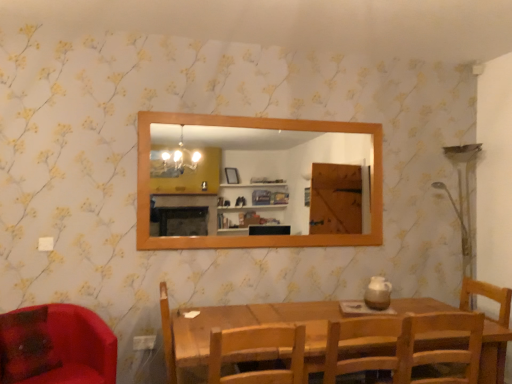
Question: Considering the relative positions of wooden chair at center, arranged as the 2th chair when viewed from the right, and matte red chair at lower left, placed as the 1th chair when sorted from left to right, in the image provided, is wooden chair at center, arranged as the 2th chair when viewed from the right, to the right of matte red chair at lower left, placed as the 1th chair when sorted from left to right, from the viewer's perspective?

Choices:
 (A) no
 (B) yes

Answer: (B)

Question: Considering the relative sizes of wooden chair at center, arranged as the 2th chair when viewed from the right, and matte red chair at lower left, which appears as the fourth chair when viewed from the right, in the image provided, is wooden chair at center, arranged as the 2th chair when viewed from the right, wider than matte red chair at lower left, which appears as the fourth chair when viewed from the right,?

Choices:
 (A) no
 (B) yes

Answer: (A)

Question: Does wooden chair at center, arranged as the 2th chair when viewed from the right, have a larger size compared to matte red chair at lower left, placed as the 1th chair when sorted from left to right?

Choices:
 (A) yes
 (B) no

Answer: (B)

Question: From the image's perspective, is wooden chair at center, arranged as the 2th chair when viewed from the right, located above matte red chair at lower left, placed as the 1th chair when sorted from left to right?

Choices:
 (A) no
 (B) yes

Answer: (B)

Question: From the image's perspective, is wooden chair at center, arranged as the third chair when viewed from the left, under matte red chair at lower left, placed as the 1th chair when sorted from left to right?

Choices:
 (A) yes
 (B) no

Answer: (B)

Question: Can we say wooden chair at center, arranged as the third chair when viewed from the left, lies outside matte red chair at lower left, placed as the 1th chair when sorted from left to right?

Choices:
 (A) no
 (B) yes

Answer: (B)

Question: Considering the relative sizes of wooden chair at center, arranged as the third chair when viewed from the right, and wooden chair at lower right, which is counted as the fourth chair, starting from the left, in the image provided, is wooden chair at center, arranged as the third chair when viewed from the right, wider than wooden chair at lower right, which is counted as the fourth chair, starting from the left,?

Choices:
 (A) no
 (B) yes

Answer: (B)

Question: Does wooden chair at center, arranged as the third chair when viewed from the right, have a greater height compared to wooden chair at lower right, which is counted as the fourth chair, starting from the left?

Choices:
 (A) yes
 (B) no

Answer: (B)

Question: From the image's perspective, is wooden chair at center, arranged as the third chair when viewed from the right, below wooden chair at lower right, which is counted as the fourth chair, starting from the left?

Choices:
 (A) no
 (B) yes

Answer: (A)

Question: Is wooden chair at center, arranged as the third chair when viewed from the right, oriented away from wooden chair at lower right, which is counted as the 1th chair, starting from the right?

Choices:
 (A) no
 (B) yes

Answer: (A)

Question: Is wooden chair at center, arranged as the third chair when viewed from the right, bigger than wooden chair at lower right, which is counted as the fourth chair, starting from the left?

Choices:
 (A) no
 (B) yes

Answer: (A)

Question: Considering the relative sizes of wooden chair at center, arranged as the third chair when viewed from the right, and wooden chair at lower right, which is counted as the fourth chair, starting from the left, in the image provided, is wooden chair at center, arranged as the third chair when viewed from the right, thinner than wooden chair at lower right, which is counted as the fourth chair, starting from the left,?

Choices:
 (A) no
 (B) yes

Answer: (A)

Question: Considering the relative sizes of wooden chair at center, arranged as the third chair when viewed from the left, and wooden mirror at upper center in the image provided, is wooden chair at center, arranged as the third chair when viewed from the left, taller than wooden mirror at upper center?

Choices:
 (A) yes
 (B) no

Answer: (B)